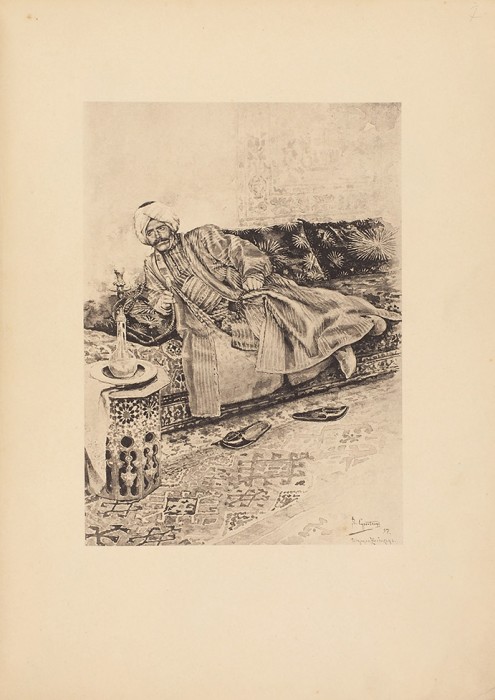
Image resolution: width=495 pixels, height=700 pixels. What are the coordinates of `persian style octagonal base end table` in the screenshot? It's located at (149, 416), (138, 453), (129, 428).